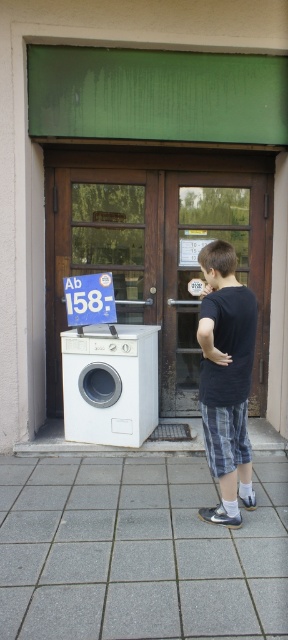
In the scene shown: Who is positioned more to the left, white plastic washing machine at lower left or white glossy washing machine at left?

From the viewer's perspective, white glossy washing machine at left appears more on the left side.

Can you confirm if white plastic washing machine at lower left is taller than white glossy washing machine at left?

Correct, white plastic washing machine at lower left is much taller as white glossy washing machine at left.

This screenshot has width=288, height=640. I want to click on white plastic washing machine at lower left, so click(156, 246).

Where is `white plastic washing machine at lower left`? The height and width of the screenshot is (640, 288). white plastic washing machine at lower left is located at coordinates (156, 246).

Is point (141, 556) farther from camera compared to point (69, 200)?

No, (141, 556) is in front of (69, 200).

Who is shorter, gray concrete pavement at lower center or white plastic washing machine at lower left?

gray concrete pavement at lower center is shorter.

This screenshot has width=288, height=640. Identify the location of gray concrete pavement at lower center. (137, 552).

Is point (67, 604) farther from camera compared to point (65, 332)?

No, it is in front of (65, 332).

Can you confirm if gray concrete pavement at lower center is positioned above white glossy washing machine at left?

No.

Does point (78, 474) lie behind point (137, 445)?

No, it is not.

You are a GUI agent. You are given a task and a screenshot of the screen. Output one action in this format:
    pyautogui.click(x=<x>, y=<y>)
    Task: Click on the gray concrete pavement at lower center
    
    Given the screenshot: What is the action you would take?
    pyautogui.click(x=137, y=552)